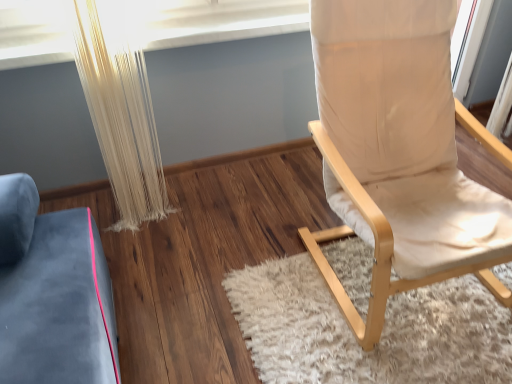
Find the location of a particular element. white shaggy rug at center is located at coordinates (381, 334).

What do you see at coordinates (381, 334) in the screenshot? I see `white shaggy rug at center` at bounding box center [381, 334].

Where is `beige fabric chair at right`? Image resolution: width=512 pixels, height=384 pixels. beige fabric chair at right is located at coordinates (398, 154).

Which of these two, beige fabric chair at right or white textured curtain at left, stands shorter?

white textured curtain at left is shorter.

From a real-world perspective, is beige fabric chair at right physically below white textured curtain at left?

Incorrect, from a real-world perspective, beige fabric chair at right is higher than white textured curtain at left.

Is white textured curtain at left not within beige fabric chair at right?

Yes, white textured curtain at left is not within beige fabric chair at right.

From a real-world perspective, is white textured curtain at left on top of beige fabric chair at right?

No, from a real-world perspective, white textured curtain at left is not over beige fabric chair at right

Between white shaggy rug at center and beige fabric chair at right, which one appears on the left side from the viewer's perspective?

white shaggy rug at center is more to the left.

Which object is thinner, white shaggy rug at center or beige fabric chair at right?

beige fabric chair at right is thinner.

Is white shaggy rug at center oriented away from beige fabric chair at right?

That's not correct — white shaggy rug at center is not looking away from beige fabric chair at right.

Looking at the image, does white shaggy rug at center seem bigger or smaller compared to beige fabric chair at right?

Clearly, white shaggy rug at center is smaller in size than beige fabric chair at right.

From a real-world perspective, is beige fabric chair at right on top of white shaggy rug at center?

Yes, from a real-world perspective, beige fabric chair at right is over white shaggy rug at center

From the image's perspective, is beige fabric chair at right beneath white shaggy rug at center?

No, from the image's perspective, beige fabric chair at right is not below white shaggy rug at center.

Considering the relative positions of beige fabric chair at right and white shaggy rug at center in the image provided, is beige fabric chair at right in front of white shaggy rug at center?

Yes, it is.

Is white shaggy rug at center a part of beige fabric chair at right?

That's incorrect, white shaggy rug at center is not inside beige fabric chair at right.

Is white textured curtain at left aimed at white shaggy rug at center?

No, white textured curtain at left is not facing towards white shaggy rug at center.

Are white textured curtain at left and white shaggy rug at center located far from each other?

white textured curtain at left is actually quite close to white shaggy rug at center.

Is white textured curtain at left taller than white shaggy rug at center?

Yes, white textured curtain at left is taller than white shaggy rug at center.

Is white textured curtain at left completely or partially outside of white shaggy rug at center?

Yes, white textured curtain at left is located beyond the bounds of white shaggy rug at center.

Looking at this image, between white shaggy rug at center and white textured curtain at left, which one has larger width?

With larger width is white shaggy rug at center.

From a real-world perspective, which is physically below, white shaggy rug at center or white textured curtain at left?

In real-world perspective, white shaggy rug at center is lower.

Is white shaggy rug at center outside of white textured curtain at left?

Yes, white shaggy rug at center is located beyond the bounds of white textured curtain at left.

Is white shaggy rug at center at the right side of white textured curtain at left?

Correct, you'll find white shaggy rug at center to the right of white textured curtain at left.

The height and width of the screenshot is (384, 512). Identify the location of curtain below the beige fabric chair at right (from a real-world perspective). point(120,110).

Where is `curtain that appears above the beige fabric chair at right (from the image's perspective)`? The image size is (512, 384). curtain that appears above the beige fabric chair at right (from the image's perspective) is located at coordinates (120, 110).

Which object lies nearer to the anchor point white textured curtain at left, white shaggy rug at center or beige fabric chair at right?

Among the two, white shaggy rug at center is located nearer to white textured curtain at left.

From the image, which object appears to be nearer to beige fabric chair at right, white textured curtain at left or white shaggy rug at center?

white shaggy rug at center.

Looking at the image, which one is located closer to white textured curtain at left, beige fabric chair at right or white shaggy rug at center?

white shaggy rug at center is positioned closer to the anchor white textured curtain at left.

Looking at the image, which one is located further to white shaggy rug at center, white textured curtain at left or beige fabric chair at right?

white textured curtain at left.

Looking at the image, which one is located further to white shaggy rug at center, beige fabric chair at right or white textured curtain at left?

Among the two, white textured curtain at left is located further to white shaggy rug at center.

From the image, which object appears to be nearer to beige fabric chair at right, white shaggy rug at center or white textured curtain at left?

The object closer to beige fabric chair at right is white shaggy rug at center.

This screenshot has width=512, height=384. What are the coordinates of `mat located between white textured curtain at left and beige fabric chair at right in the left-right direction` in the screenshot? It's located at (381, 334).